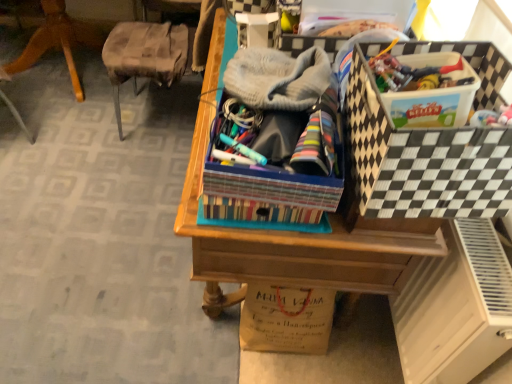
Question: From a real-world perspective, is white matte file cabinet at lower right physically above wooden chair at left?

Choices:
 (A) yes
 (B) no

Answer: (A)

Question: Can you confirm if white matte file cabinet at lower right is thinner than wooden chair at left?

Choices:
 (A) yes
 (B) no

Answer: (A)

Question: Can you confirm if white matte file cabinet at lower right is bigger than wooden chair at left?

Choices:
 (A) no
 (B) yes

Answer: (A)

Question: Is white matte file cabinet at lower right far away from wooden chair at left?

Choices:
 (A) yes
 (B) no

Answer: (A)

Question: Is white matte file cabinet at lower right facing away from wooden chair at left?

Choices:
 (A) yes
 (B) no

Answer: (B)

Question: In the image, is white matte file cabinet at lower right on the left side or the right side of black and white checkered storage box at upper right?

Choices:
 (A) left
 (B) right

Answer: (B)

Question: From their relative heights in the image, would you say white matte file cabinet at lower right is taller or shorter than black and white checkered storage box at upper right?

Choices:
 (A) tall
 (B) short

Answer: (A)

Question: Is white matte file cabinet at lower right situated inside black and white checkered storage box at upper right or outside?

Choices:
 (A) outside
 (B) inside

Answer: (A)

Question: Considering the positions of white matte file cabinet at lower right and black and white checkered storage box at upper right in the image, is white matte file cabinet at lower right bigger or smaller than black and white checkered storage box at upper right?

Choices:
 (A) small
 (B) big

Answer: (B)

Question: Is black and white checkered storage box at upper right taller or shorter than white matte file cabinet at lower right?

Choices:
 (A) short
 (B) tall

Answer: (A)

Question: From the image's perspective, is black and white checkered storage box at upper right above or below white matte file cabinet at lower right?

Choices:
 (A) below
 (B) above

Answer: (B)

Question: Is point (468, 150) closer or farther from the camera than point (479, 248)?

Choices:
 (A) closer
 (B) farther

Answer: (A)

Question: Is black and white checkered storage box at upper right wider or thinner than white matte file cabinet at lower right?

Choices:
 (A) thin
 (B) wide

Answer: (B)

Question: Relative to gray knitted hat at center, is wooden desk at center in front or behind?

Choices:
 (A) behind
 (B) front

Answer: (A)

Question: Considering the positions of wooden desk at center and gray knitted hat at center in the image, is wooden desk at center wider or thinner than gray knitted hat at center?

Choices:
 (A) wide
 (B) thin

Answer: (A)